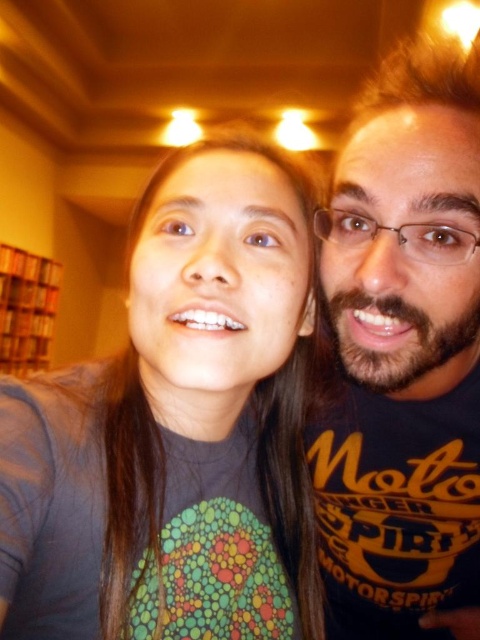
You are a photographer trying to adjust the lighting for a portrait. You notice a point at coordinates [177,429] in the image. Based on the scene description, what object is located at this point?

The point at coordinates [177,429] indicates the gray matte shirt at center.

You are holding a camera and want to take a selfie with two people. The point where you are standing is marked as point (404, 444). If the recommended distance for a clear selfie is 28 inches, is your current position too close or too far?

The point (404, 444) and camera are 29.13 inches apart from each other. Since the recommended distance is 28 inches, your current position is slightly too close.